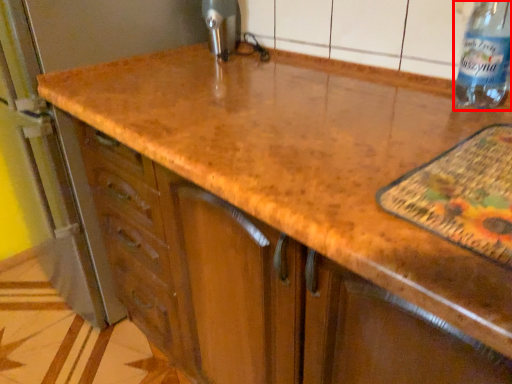
Question: Observing the image, what is the correct spatial positioning of bottle (annotated by the red box) in reference to appliance?

Choices:
 (A) right
 (B) left

Answer: (A)